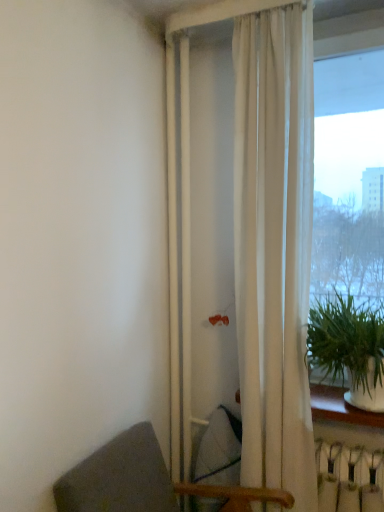
Question: Is dark gray fabric chair at lower left positioned beyond the bounds of transparent glass window at right?

Choices:
 (A) no
 (B) yes

Answer: (B)

Question: Considering the relative sizes of dark gray fabric chair at lower left and transparent glass window at right in the image provided, is dark gray fabric chair at lower left thinner than transparent glass window at right?

Choices:
 (A) yes
 (B) no

Answer: (B)

Question: Would you say dark gray fabric chair at lower left contains transparent glass window at right?

Choices:
 (A) no
 (B) yes

Answer: (A)

Question: Is dark gray fabric chair at lower left positioned in front of transparent glass window at right?

Choices:
 (A) yes
 (B) no

Answer: (A)

Question: Can you confirm if dark gray fabric chair at lower left is smaller than transparent glass window at right?

Choices:
 (A) no
 (B) yes

Answer: (A)

Question: Is dark gray fabric chair at lower left to the left of transparent glass window at right from the viewer's perspective?

Choices:
 (A) no
 (B) yes

Answer: (B)

Question: Would you say dark gray fabric chair at lower left is part of transparent glass window at right's contents?

Choices:
 (A) yes
 (B) no

Answer: (B)

Question: Can you confirm if transparent glass window at right is bigger than dark gray fabric chair at lower left?

Choices:
 (A) no
 (B) yes

Answer: (A)

Question: Can you confirm if transparent glass window at right is thinner than dark gray fabric chair at lower left?

Choices:
 (A) yes
 (B) no

Answer: (A)

Question: Considering the relative sizes of transparent glass window at right and dark gray fabric chair at lower left in the image provided, is transparent glass window at right shorter than dark gray fabric chair at lower left?

Choices:
 (A) yes
 (B) no

Answer: (B)

Question: Is transparent glass window at right positioned behind dark gray fabric chair at lower left?

Choices:
 (A) no
 (B) yes

Answer: (B)

Question: From a real-world perspective, is transparent glass window at right physically below dark gray fabric chair at lower left?

Choices:
 (A) no
 (B) yes

Answer: (A)

Question: Is dark gray fabric chair at lower left oriented towards green leafy plant at right?

Choices:
 (A) yes
 (B) no

Answer: (B)